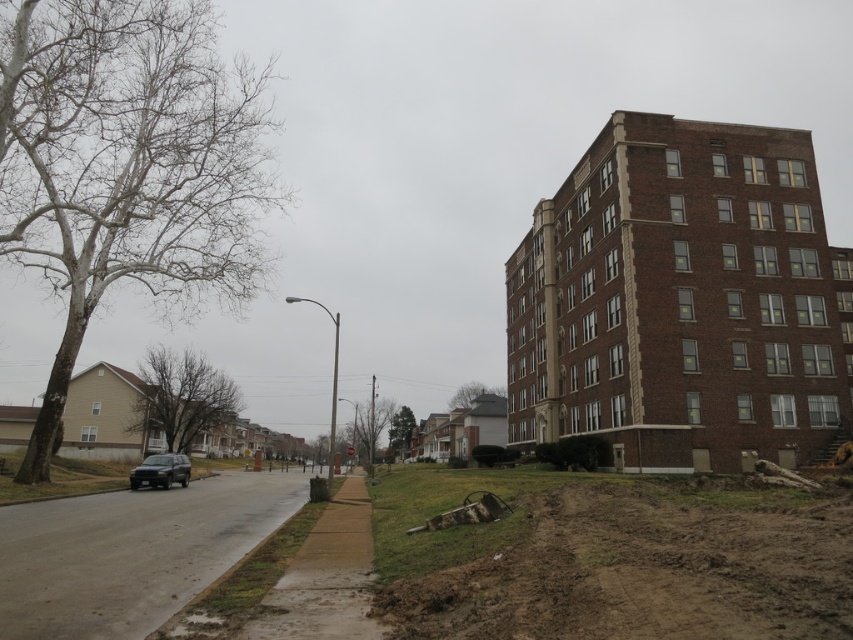
You are a city planner analyzing the urban space. You need to determine which tree, the brown leafless tree at center or the green matte tree at center, requires more space for maintenance. Based on their sizes, which one would need more space?

The brown leafless tree at center is bigger than the green matte tree at center, so it would require more space for maintenance.

You are a pedestrian standing at point (370, 426) in the urban street scene. You want to walk to the multi story brick building with symmetrical design on the right side. Is the brown leafless tree at center blocking your path?

The brown leafless tree at center is located at point (370, 426), which is your current position. Since you are already at the location of the tree, it is not blocking your path to the multi story brick building with symmetrical design on the right side.

You are standing at the center of the image and want to walk to the gray asphalt road at lower left. In which direction should you move relative to your current position?

You should move towards the lower left direction to reach the gray asphalt road at lower left.